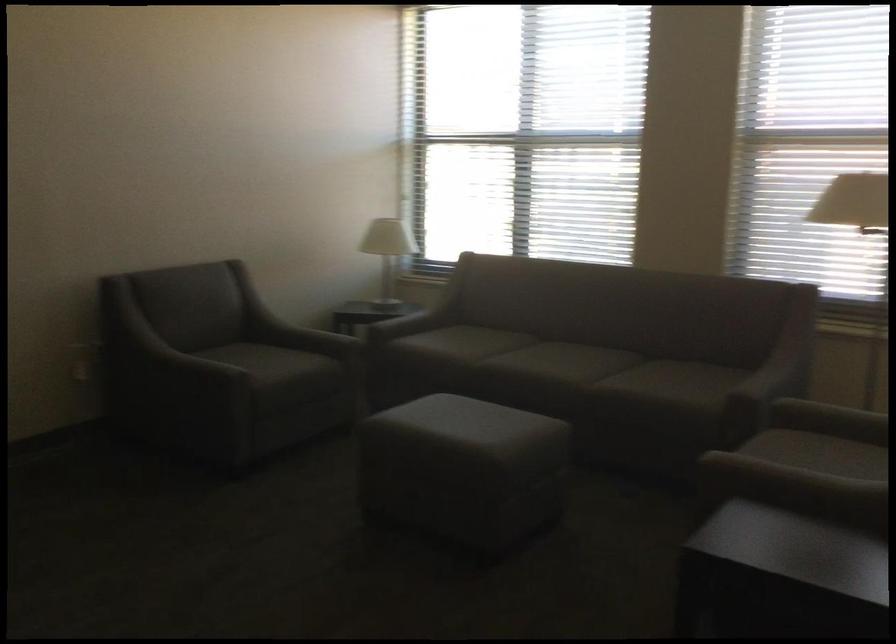
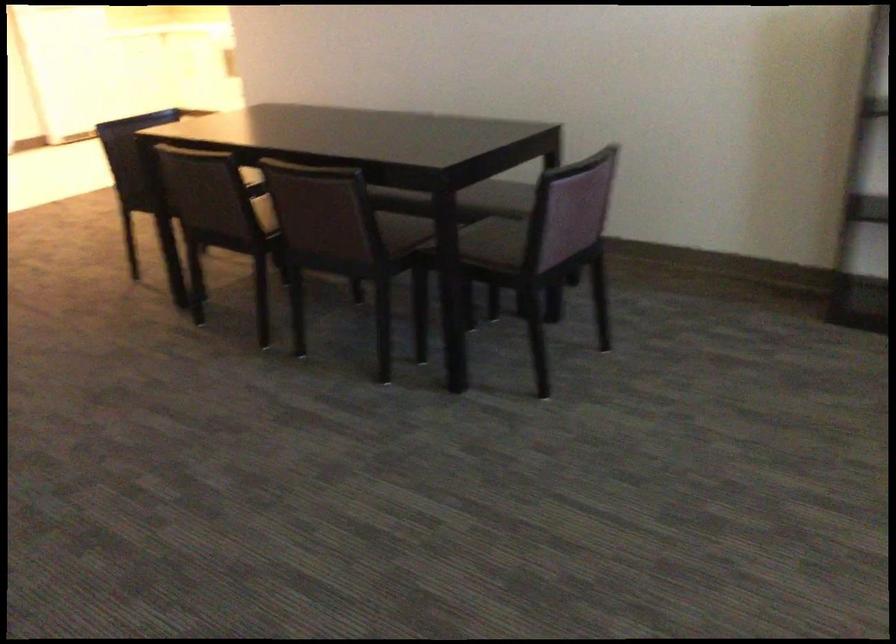
The first image is from the beginning of the video and the second image is from the end. How did the camera likely rotate when shooting the video?

The camera's rotation is toward left-down.